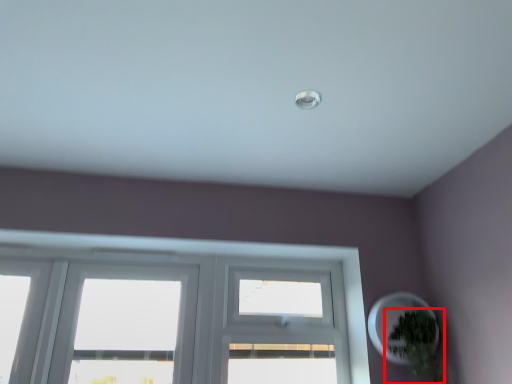
Question: From the image's perspective, where is houseplant (annotated by the red box) located in relation to oval in the image?

Choices:
 (A) below
 (B) above

Answer: (A)